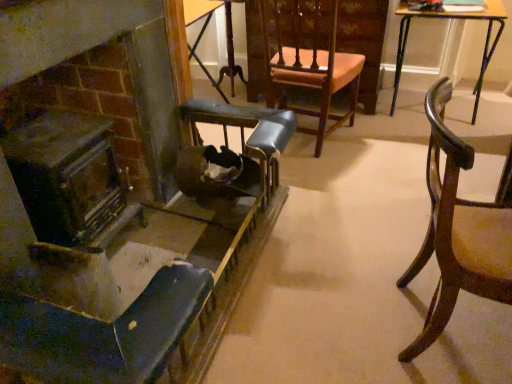
Where is `vacant area that is situated to the right of wooden chair with upholstered seat at center, the 2th chair positioned from the left`? This screenshot has height=384, width=512. vacant area that is situated to the right of wooden chair with upholstered seat at center, the 2th chair positioned from the left is located at coordinates (378, 142).